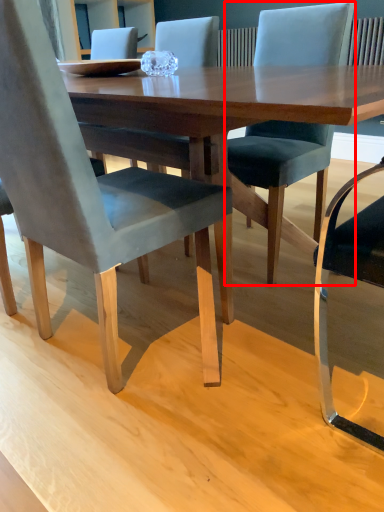
Question: In this image, where is chair (annotated by the red box) located relative to chair?

Choices:
 (A) right
 (B) left

Answer: (A)